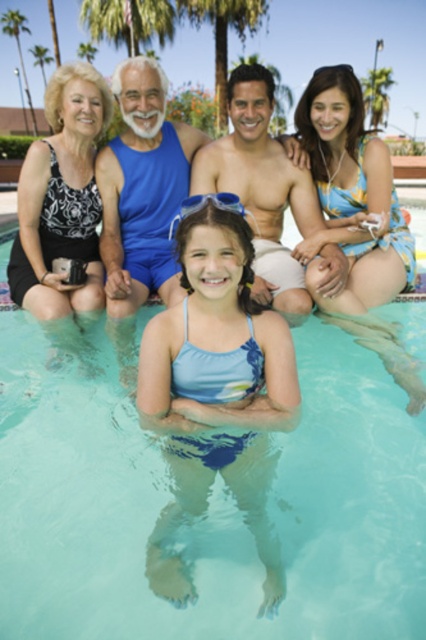
Question: Estimate the real-world distances between objects in this image. Which object is closer to the floral fabric bikini top at upper right?

Choices:
 (A) blue rubber goggles at center
 (B) clear blue water at center
 (C) matte blue swimsuit at center

Answer: (C)

Question: Does green leafy palm tree at upper center have a greater width compared to blue rubber goggles at center?

Choices:
 (A) no
 (B) yes

Answer: (B)

Question: Which object is positioned farthest from the matte blue swimsuit at center?

Choices:
 (A) blue rubber goggles at center
 (B) green leafy palm tree at upper center

Answer: (B)

Question: Does matte blue swimsuit at center have a greater width compared to green leafy palm tree at upper center?

Choices:
 (A) yes
 (B) no

Answer: (B)

Question: Is clear blue water at center bigger than green leafy palm tree at upper center?

Choices:
 (A) yes
 (B) no

Answer: (B)

Question: Estimate the real-world distances between objects in this image. Which object is farther from the blue fabric shorts at upper center?

Choices:
 (A) light blue fabric swimsuit at center
 (B) blue rubber goggles at center

Answer: (B)